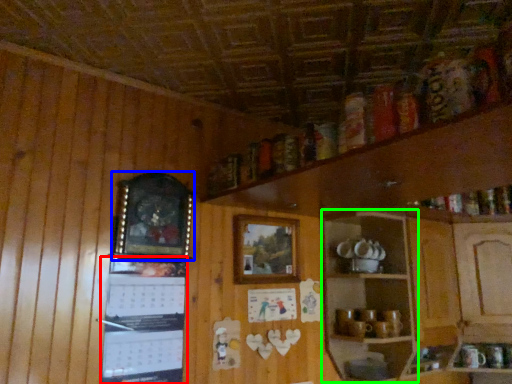
Question: Which object is the closest to the bulletin board (highlighted by a red box)? Choose among these: picture frame (highlighted by a blue box) or shelf (highlighted by a green box).

Choices:
 (A) picture frame
 (B) shelf

Answer: (A)